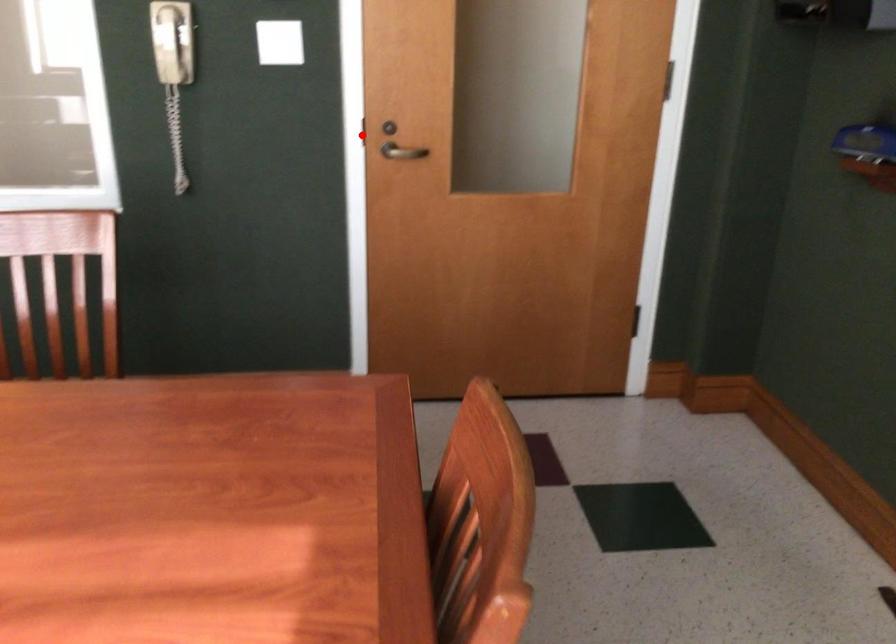
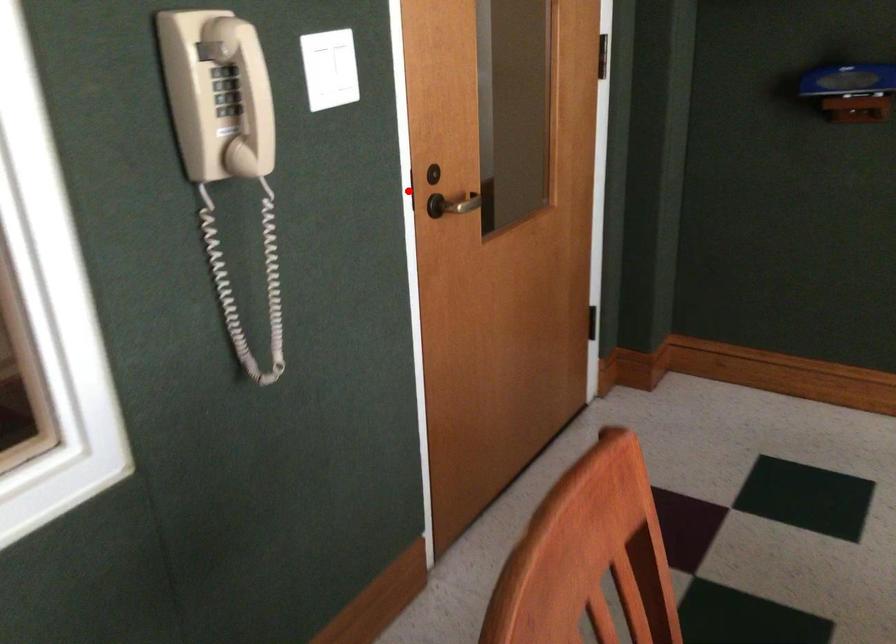
I am providing you with two images of the same scene from different viewpoints. A red point is marked on the first image and another point is marked on the second image. Is the marked point in image1 the same physical position as the marked point in image2?

Yes